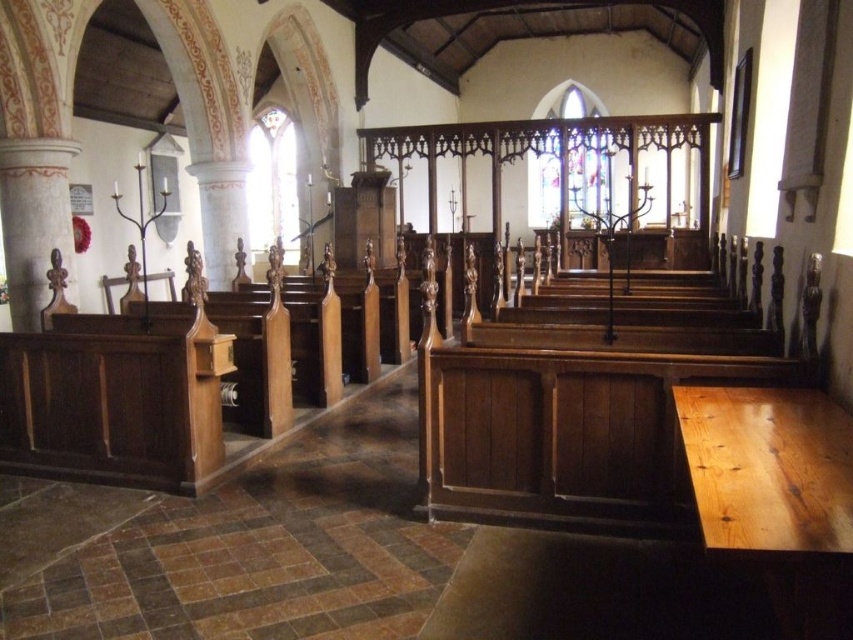
Question: Does stained glass at center have a greater width compared to clear stained glass window at upper left?

Choices:
 (A) no
 (B) yes

Answer: (A)

Question: Is stained glass at center wider than clear stained glass window at upper left?

Choices:
 (A) yes
 (B) no

Answer: (B)

Question: Which object is closer to the camera taking this photo?

Choices:
 (A) clear stained glass window at upper left
 (B) stained glass at center

Answer: (B)

Question: Can you confirm if stained glass at center is positioned above clear stained glass window at upper left?

Choices:
 (A) yes
 (B) no

Answer: (A)